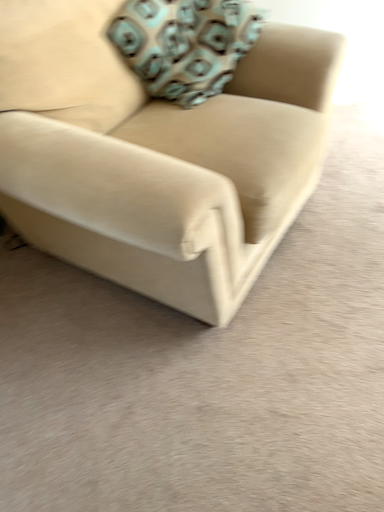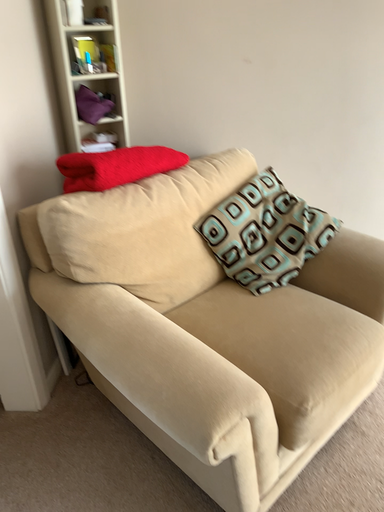
Question: Which way did the camera rotate in the video?

Choices:
 (A) rotated upward
 (B) rotated downward

Answer: (A)